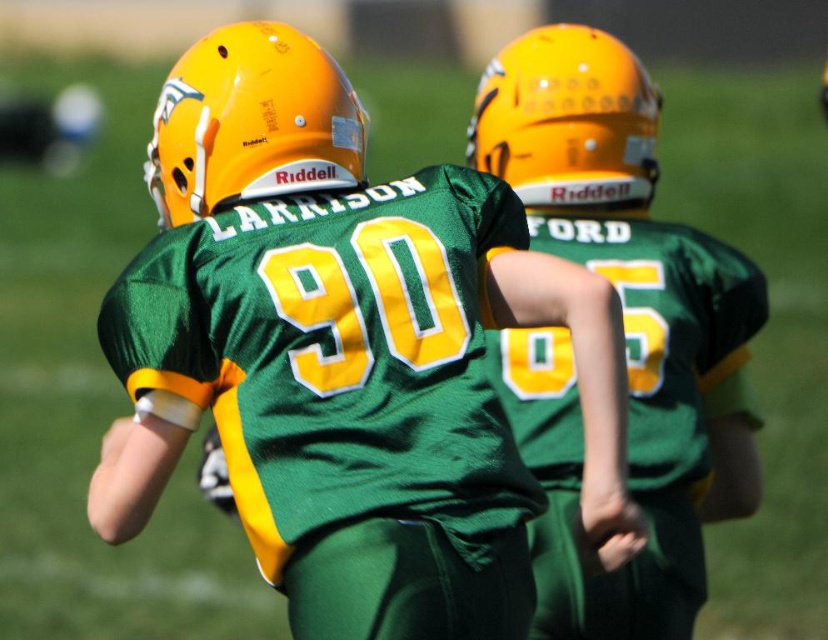
You are a photographer trying to capture a clear shot of both the matte green jersey at center and the matte orange helmet at upper center in the image. Since you want to ensure both are visible, which object should you focus on first considering their sizes?

The matte green jersey at center is larger in size than the matte orange helmet at upper center, so you should focus on the matte green jersey at center first as it takes up more space in the frame.

You are a photographer standing behind two football players. You notice the matte green jersey at center and the matte orange helmet at upper center. Which object is higher up in the image?

The matte green jersey at center is taller than the matte orange helmet at upper center, so the matte green jersey at center is higher up in the image.